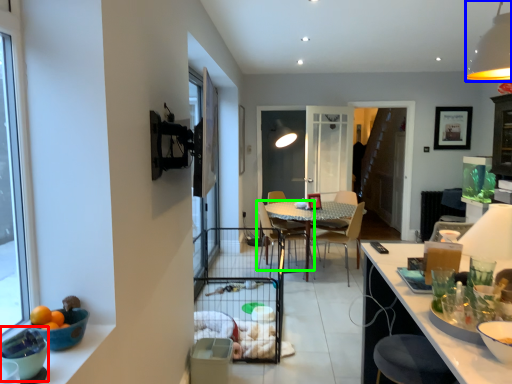
Question: Based on their relative distances, which object is nearer to bowl (highlighted by a red box)? Choose from light fixture (highlighted by a blue box) and chair (highlighted by a green box).

Choices:
 (A) light fixture
 (B) chair

Answer: (A)